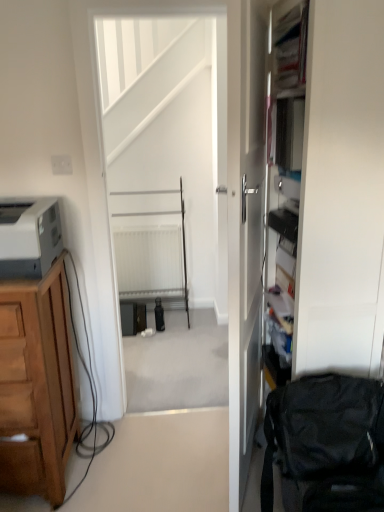
Question: Does white glossy door at center have a lesser width compared to brown wooden cabinet at left?

Choices:
 (A) yes
 (B) no

Answer: (A)

Question: From the image's perspective, is white glossy door at center above brown wooden cabinet at left?

Choices:
 (A) no
 (B) yes

Answer: (B)

Question: Is white glossy door at center located outside brown wooden cabinet at left?

Choices:
 (A) no
 (B) yes

Answer: (B)

Question: Is white glossy door at center to the left of brown wooden cabinet at left from the viewer's perspective?

Choices:
 (A) no
 (B) yes

Answer: (A)

Question: Is white glossy door at center oriented towards brown wooden cabinet at left?

Choices:
 (A) no
 (B) yes

Answer: (B)

Question: Is white glossy door at center to the right of brown wooden cabinet at left from the viewer's perspective?

Choices:
 (A) no
 (B) yes

Answer: (B)

Question: Is white glossy door at center wider than white plastic electric outlet at upper left?

Choices:
 (A) no
 (B) yes

Answer: (B)

Question: Is white glossy door at center shorter than white plastic electric outlet at upper left?

Choices:
 (A) yes
 (B) no

Answer: (B)

Question: Can you confirm if white glossy door at center is positioned to the right of white plastic electric outlet at upper left?

Choices:
 (A) yes
 (B) no

Answer: (A)

Question: Is white glossy door at center positioned beyond the bounds of white plastic electric outlet at upper left?

Choices:
 (A) no
 (B) yes

Answer: (B)

Question: Does white glossy door at center have a larger size compared to white plastic electric outlet at upper left?

Choices:
 (A) no
 (B) yes

Answer: (B)

Question: Can you confirm if white glossy door at center is thinner than white plastic electric outlet at upper left?

Choices:
 (A) yes
 (B) no

Answer: (B)

Question: Is matte gray printer at left smaller than white matte screen door at center?

Choices:
 (A) yes
 (B) no

Answer: (A)